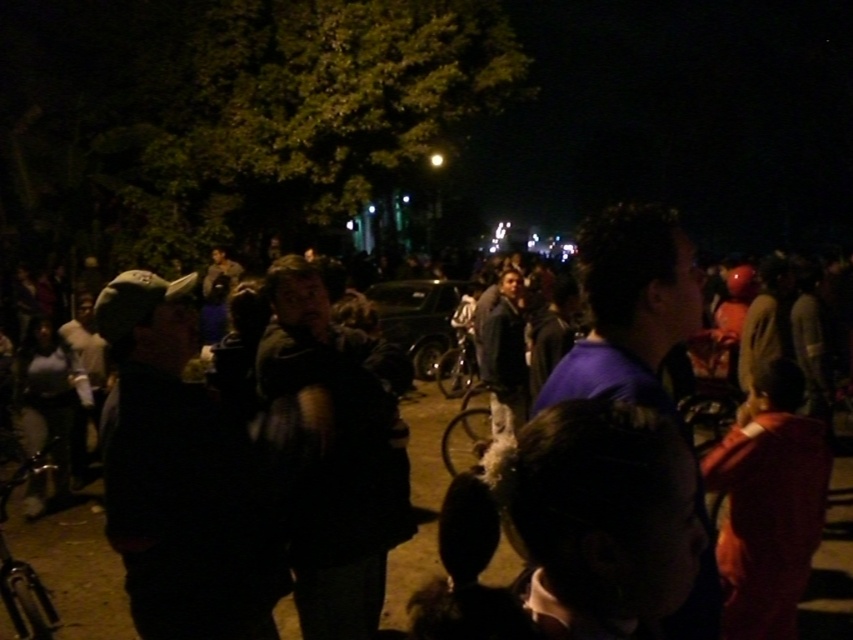
Can you confirm if dark blue jacket at center is positioned to the right of shiny metallic bicycle at lower left?

Incorrect, dark blue jacket at center is not on the right side of shiny metallic bicycle at lower left.

Which is in front, point (77, 566) or point (13, 476)?

Point (77, 566) is in front.

Who is more distant from viewer, (85,570) or (0,481)?

The point (0,481) is behind.

Where is `dark blue jacket at center`? Image resolution: width=853 pixels, height=640 pixels. dark blue jacket at center is located at coordinates (76, 568).